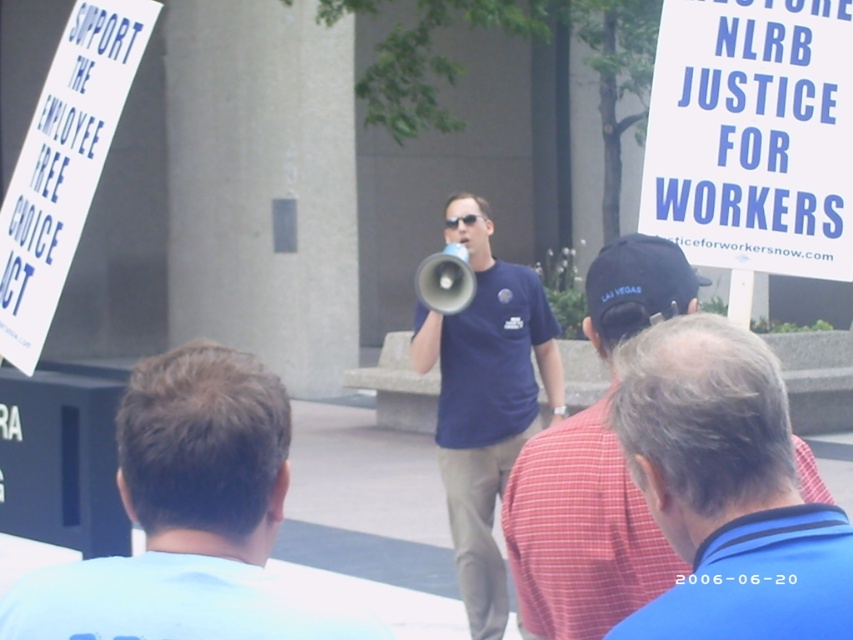
You are a photographer trying to capture a clear photo of both the red plaid shirt at center and the blue cotton shirt at center. Since you want to ensure both shirts are visible in the frame, which shirt should you focus on first considering their heights?

The red plaid shirt at center is shorter than the blue cotton shirt at center, so you should focus on the red plaid shirt at center first to ensure it is in the foreground and visible.